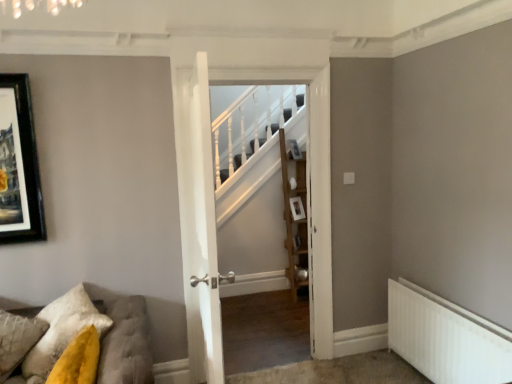
Measure the distance between white wooden door at center, which is counted as the 2th door, starting from the front, and camera.

white wooden door at center, which is counted as the 2th door, starting from the front, is 6.08 feet from camera.

This screenshot has width=512, height=384. What do you see at coordinates (17, 340) in the screenshot?
I see `textured yellow pillow at lower left` at bounding box center [17, 340].

Describe the element at coordinates (444, 341) in the screenshot. This screenshot has width=512, height=384. I see `white metallic radiator at lower right` at that location.

Where is `tufted fabric sofa at lower left`? tufted fabric sofa at lower left is located at coordinates pos(103,344).

Is textured yellow pillow at lower left positioned with its back to wooden shelf at center?

textured yellow pillow at lower left is not turned away from wooden shelf at center.

Considering the sizes of objects textured yellow pillow at lower left and wooden shelf at center in the image provided, who is taller, textured yellow pillow at lower left or wooden shelf at center?

Standing taller between the two is wooden shelf at center.

Is point (24, 340) behind point (303, 237)?

No, (24, 340) is closer to viewer.

Would you say wooden shelf at center is part of textured yellow pillow at lower left's contents?

No, textured yellow pillow at lower left does not contain wooden shelf at center.

This screenshot has width=512, height=384. I want to click on shelf located behind the tufted fabric sofa at lower left, so click(x=295, y=221).

Is tufted fabric sofa at lower left aimed at wooden shelf at center?

No, tufted fabric sofa at lower left does not turn towards wooden shelf at center.

Is tufted fabric sofa at lower left surrounding wooden shelf at center?

That's incorrect, wooden shelf at center is not inside tufted fabric sofa at lower left.

Is tufted fabric sofa at lower left positioned far away from wooden shelf at center?

Absolutely, tufted fabric sofa at lower left is distant from wooden shelf at center.

Is point (314, 189) in front of point (192, 174)?

No, it is behind (192, 174).

From the image's perspective, does white wooden door at center, which is the 1th door in back-to-front order, appear higher than white wooden door at center, the 1th door when ordered from front to back?

Yes, from the image's perspective, white wooden door at center, which is the 1th door in back-to-front order, is above white wooden door at center, the 1th door when ordered from front to back.

Can white wooden door at center, which ranks as the second door in back-to-front order, be found inside white wooden door at center, which is counted as the 2th door, starting from the front?

That's incorrect, white wooden door at center, which ranks as the second door in back-to-front order, is not inside white wooden door at center, which is counted as the 2th door, starting from the front.

Can you confirm if wooden shelf at center is thinner than tufted fabric sofa at lower left?

Correct, the width of wooden shelf at center is less than that of tufted fabric sofa at lower left.

How many degrees apart are the facing directions of wooden shelf at center and tufted fabric sofa at lower left?

They differ by 0.352 degrees in their facing directions.

Looking at this image, is wooden shelf at center placed right next to tufted fabric sofa at lower left?

No, wooden shelf at center is not making contact with tufted fabric sofa at lower left.

Considering the relative sizes of wooden shelf at center and tufted fabric sofa at lower left in the image provided, is wooden shelf at center smaller than tufted fabric sofa at lower left?

Correct, wooden shelf at center occupies less space than tufted fabric sofa at lower left.

Considering the sizes of objects tufted fabric sofa at lower left and textured yellow pillow at lower left in the image provided, who is taller, tufted fabric sofa at lower left or textured yellow pillow at lower left?

With more height is tufted fabric sofa at lower left.

In the scene shown: From the image's perspective, is tufted fabric sofa at lower left above or below textured yellow pillow at lower left?

Clearly, from the image's perspective, tufted fabric sofa at lower left is below textured yellow pillow at lower left.

Between point (145, 358) and point (8, 375), which one is positioned behind?

The point (8, 375) is behind.

Which of these two, textured yellow pillow at lower left or white wooden door at center, which is counted as the 2th door, starting from the front, is bigger?

white wooden door at center, which is counted as the 2th door, starting from the front.

Which is more to the left, textured yellow pillow at lower left or white wooden door at center, which is the 1th door in back-to-front order?

textured yellow pillow at lower left is more to the left.

Considering the positions of points (17, 363) and (217, 357), is point (17, 363) farther from camera compared to point (217, 357)?

Yes, it is.

Identify the location of radiator that appears below the white wooden door at center, which ranks as the second door in back-to-front order (from a real-world perspective). This screenshot has height=384, width=512. (444, 341).

Is white metallic radiator at lower right aimed at white wooden door at center, the 1th door when ordered from front to back?

Yes, white metallic radiator at lower right is turned towards white wooden door at center, the 1th door when ordered from front to back.

Is white metallic radiator at lower right inside or outside of white wooden door at center, the 1th door when ordered from front to back?

white metallic radiator at lower right lies outside white wooden door at center, the 1th door when ordered from front to back.

Based on the photo, from the image's perspective, does white metallic radiator at lower right appear higher than white wooden door at center, which ranks as the second door in back-to-front order?

Actually, white metallic radiator at lower right appears below white wooden door at center, which ranks as the second door in back-to-front order, in the image.

Image resolution: width=512 pixels, height=384 pixels. What are the coordinates of `pillow that appears below the wooden shelf at center (from the image's perspective)` in the screenshot? It's located at tap(17, 340).

Find the location of `shelf on the right of tufted fabric sofa at lower left`. shelf on the right of tufted fabric sofa at lower left is located at coordinates (295, 221).

When comparing their distances from white wooden door at center, which ranks as the second door in back-to-front order, does textured yellow pillow at lower left or white wooden door at center, which is the 1th door in back-to-front order, seem closer?

The object closer to white wooden door at center, which ranks as the second door in back-to-front order, is white wooden door at center, which is the 1th door in back-to-front order.

Looking at the image, which one is located closer to textured yellow pillow at lower left, white metallic radiator at lower right or white wooden door at center, which ranks as the second door in back-to-front order?

white wooden door at center, which ranks as the second door in back-to-front order, lies closer to textured yellow pillow at lower left than the other object.

From the picture: Which object lies further to the anchor point white wooden door at center, which is counted as the 2th door, starting from the front, textured yellow pillow at lower left or white metallic radiator at lower right?

white metallic radiator at lower right is positioned further to the anchor white wooden door at center, which is counted as the 2th door, starting from the front.

Which object lies further to the anchor point tufted fabric sofa at lower left, white wooden door at center, which is counted as the 2th door, starting from the front, or wooden shelf at center?

wooden shelf at center is positioned further to the anchor tufted fabric sofa at lower left.

When comparing their distances from textured yellow pillow at lower left, does tufted fabric sofa at lower left or white wooden door at center, which ranks as the second door in back-to-front order, seem closer?

tufted fabric sofa at lower left lies closer to textured yellow pillow at lower left than the other object.

From the image, which object appears to be nearer to white wooden door at center, which ranks as the second door in back-to-front order, wooden shelf at center or tufted fabric sofa at lower left?

tufted fabric sofa at lower left is positioned closer to the anchor white wooden door at center, which ranks as the second door in back-to-front order.

Based on their spatial positions, is tufted fabric sofa at lower left or white metallic radiator at lower right further from white wooden door at center, which is counted as the 2th door, starting from the front?

The object further to white wooden door at center, which is counted as the 2th door, starting from the front, is white metallic radiator at lower right.

Looking at the image, which one is located closer to white wooden door at center, which ranks as the second door in back-to-front order, white wooden door at center, which is counted as the 2th door, starting from the front, or textured yellow pillow at lower left?

white wooden door at center, which is counted as the 2th door, starting from the front, is closer to white wooden door at center, which ranks as the second door in back-to-front order.

Image resolution: width=512 pixels, height=384 pixels. I want to click on furniture situated between textured yellow pillow at lower left and white wooden door at center, which is counted as the 2th door, starting from the front, from left to right, so click(x=103, y=344).

You are a GUI agent. You are given a task and a screenshot of the screen. Output one action in this format:
    pyautogui.click(x=<x>, y=<y>)
    Task: Click on the door between textured yellow pillow at lower left and white wooden door at center, which is the 1th door in back-to-front order
    The height and width of the screenshot is (384, 512).
    Given the screenshot: What is the action you would take?
    pyautogui.click(x=205, y=223)

I want to click on door between white metallic radiator at lower right and wooden shelf at center in the front-back direction, so tap(197, 216).

Find the location of `door between white wooden door at center, which ranks as the second door in back-to-front order, and wooden shelf at center from front to back`. door between white wooden door at center, which ranks as the second door in back-to-front order, and wooden shelf at center from front to back is located at coordinates (197, 216).